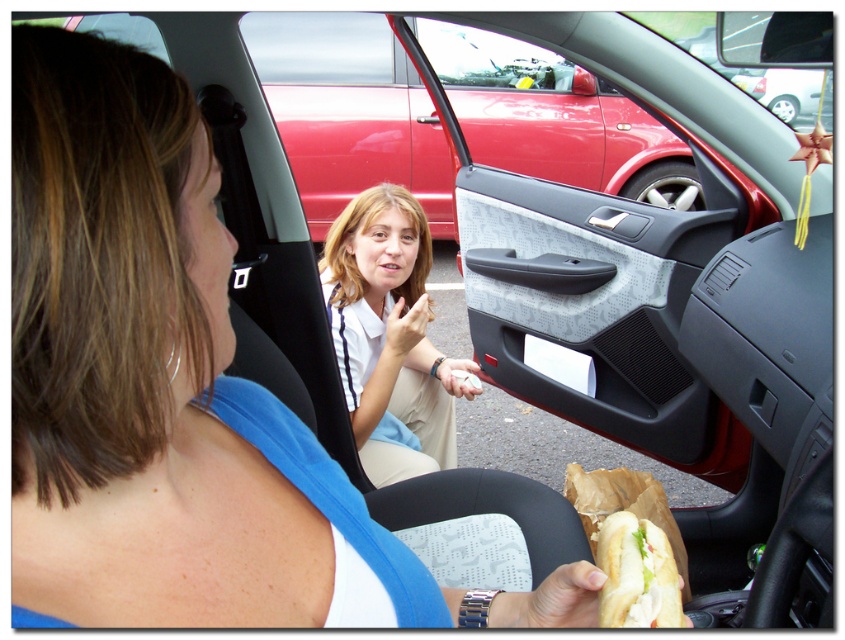
You are a passenger in the car and want to hand the white bread sandwich at lower right to the person outside. Can you reach it without moving the light brown fabric shirt at center?

The light brown fabric shirt at center is much taller than the white bread sandwich at lower right, so it might block your access. You may need to adjust the light brown fabric shirt at center to reach the white bread sandwich at lower right.

You are a passenger in the car and want to grab the white bread sandwich at lower right. Is it possible to reach it without moving the light brown fabric shirt at center?

The white bread sandwich at lower right is behind the light brown fabric shirt at center, so you can reach it without moving the light brown fabric shirt at center because it is positioned behind it.

You are standing next to the car and want to take a photo of the woman in the driver seat. The camera you have can only focus on objects within 2 meters. Is the point where the camera is positioned at point (369, 444) within the focus range of the camera?

The point (369, 444) and the camera are 1.99 meters apart, so yes, the camera can focus on the woman in the driver seat since the distance is within the 2 meters range.